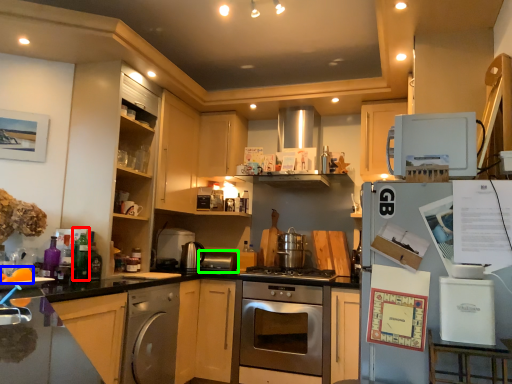
Question: Based on their relative distances, which object is farther from bottle (highlighted by a red box)? Choose from food (highlighted by a blue box) and appliance (highlighted by a green box).

Choices:
 (A) food
 (B) appliance

Answer: (B)